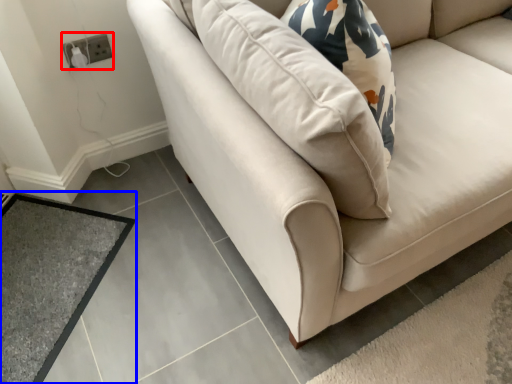
Question: Among these objects, which one is farthest to the camera, electric outlet (highlighted by a red box) or mat (highlighted by a blue box)?

Choices:
 (A) electric outlet
 (B) mat

Answer: (A)